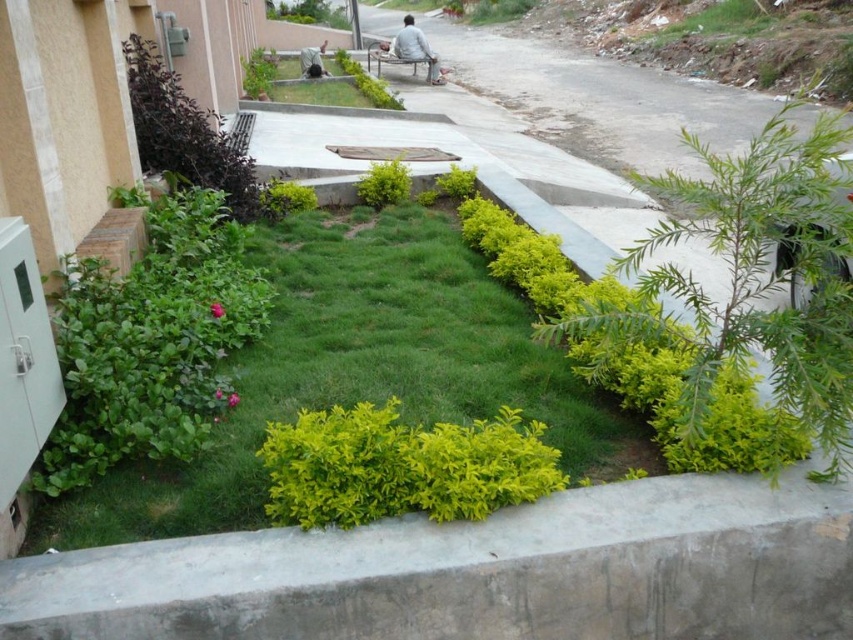
How distant is light gray fabric bench at center from wooden bench at center?

light gray fabric bench at center is 31.45 inches from wooden bench at center.

Describe the element at coordinates (416, 49) in the screenshot. This screenshot has height=640, width=853. I see `light gray fabric bench at center` at that location.

This screenshot has height=640, width=853. What do you see at coordinates (416, 49) in the screenshot?
I see `light gray fabric bench at center` at bounding box center [416, 49].

The height and width of the screenshot is (640, 853). What are the coordinates of `light gray fabric bench at center` in the screenshot? It's located at (416, 49).